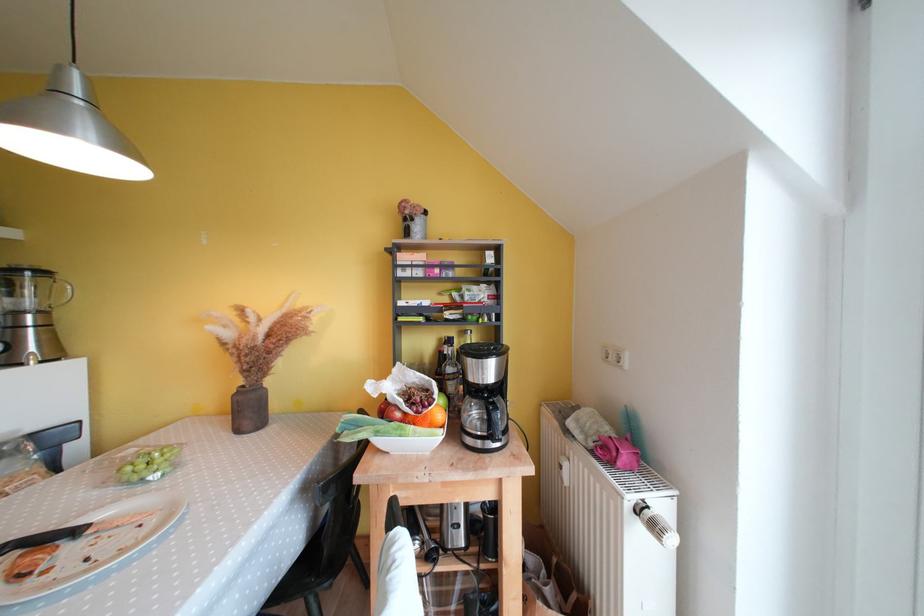
You are a GUI agent. You are given a task and a screenshot of the screen. Output one action in this format:
    pyautogui.click(x=<x>, y=<y>)
    Task: Click on the white radiator valve
    The height and width of the screenshot is (616, 924).
    Given the screenshot: What is the action you would take?
    pyautogui.click(x=564, y=469)